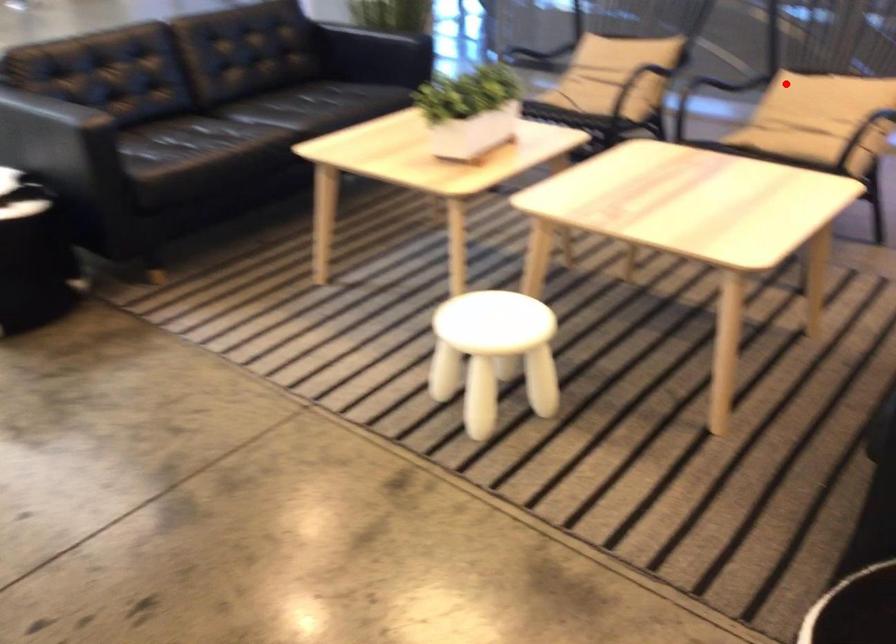
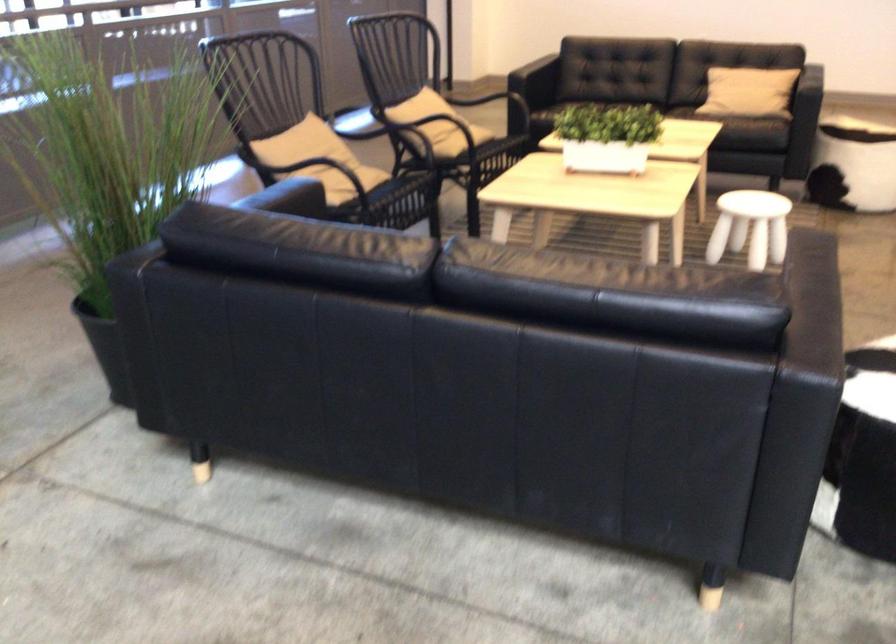
Question: I am providing you with two images of the same scene from different viewpoints. A red point is shown in image1. For the corresponding object point in image2, is it positioned nearer or farther from the camera?

Choices:
 (A) Nearer
 (B) Farther

Answer: (B)